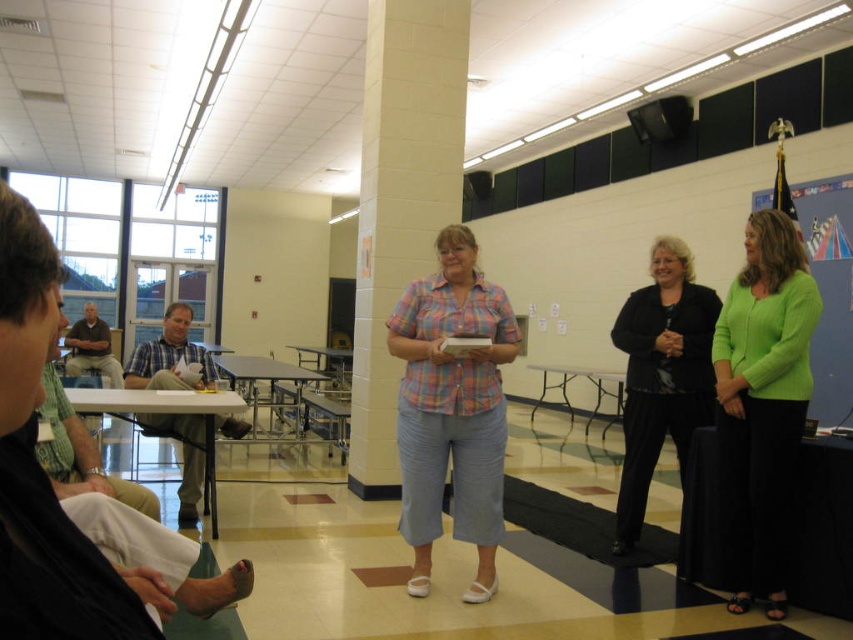
Question: Is the position of plaid fabric shirt at center less distant than that of brown cotton shirt at left?

Choices:
 (A) yes
 (B) no

Answer: (A)

Question: Which point appears farthest from the camera in this image?

Choices:
 (A) (389, 381)
 (B) (416, 480)
 (C) (186, 454)

Answer: (A)

Question: Which point is farther to the camera?

Choices:
 (A) (622, 540)
 (B) (434, 420)

Answer: (A)

Question: Can you confirm if plaid cotton shirt at center is thinner than plaid fabric shirt at center?

Choices:
 (A) no
 (B) yes

Answer: (B)

Question: Which point is closer to the camera taking this photo?

Choices:
 (A) (224, 426)
 (B) (456, 467)

Answer: (B)

Question: Does white brick pillar at center have a smaller size compared to green matte cardigan at center?

Choices:
 (A) yes
 (B) no

Answer: (B)